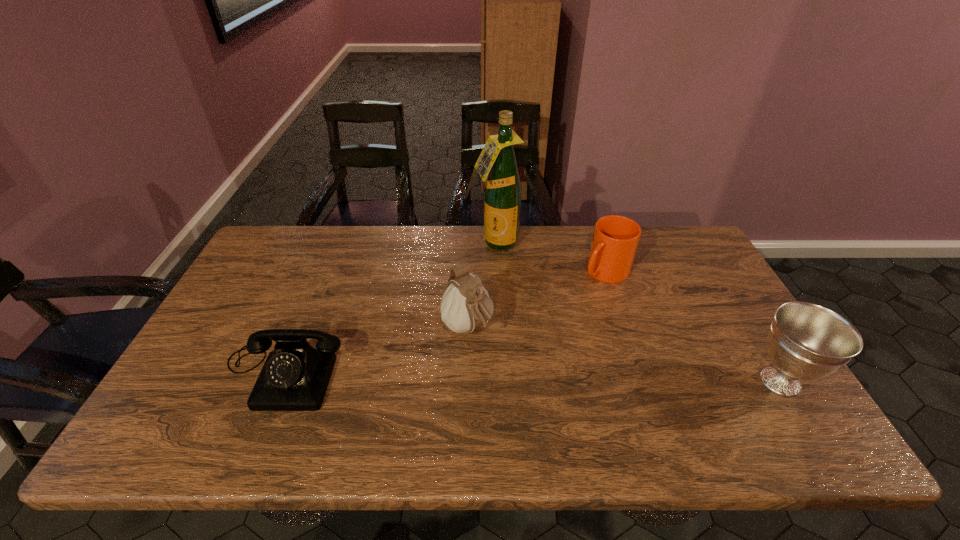
The image size is (960, 540). I want to click on vacant space that's between the leftmost object and the rightmost object, so click(532, 376).

Identify the location of free spot between the telephone and the tallest object. (x=391, y=307).

Where is `vacant region between the chalice and the farthest object`? vacant region between the chalice and the farthest object is located at coordinates (638, 312).

I want to click on empty space between the mug and the pouch, so click(536, 300).

Where is `free area in between the telephone and the rightmost object`? free area in between the telephone and the rightmost object is located at coordinates (532, 376).

Identify the location of vacant space that is in between the pouch and the telephone. (375, 349).

You are a GUI agent. You are given a task and a screenshot of the screen. Output one action in this format:
    pyautogui.click(x=<x>, y=<y>)
    Task: Click on the empty space that is in between the pouch and the chalice
    Image resolution: width=960 pixels, height=540 pixels.
    Given the screenshot: What is the action you would take?
    pyautogui.click(x=624, y=354)

I want to click on object that is the nearest to the fourth nearest object, so click(x=502, y=196).

In order to click on object that is the nearest to the fourth tallest object in this screenshot , I will do `click(502, 196)`.

This screenshot has height=540, width=960. Identify the location of free space that satisfies the following two spatial constraints: 1. on the front face of the shortest object; 2. on the left side of the rightmost object. (279, 381).